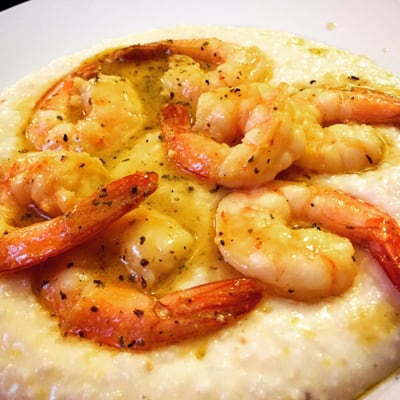
I want to click on white plate, so click(x=116, y=27).